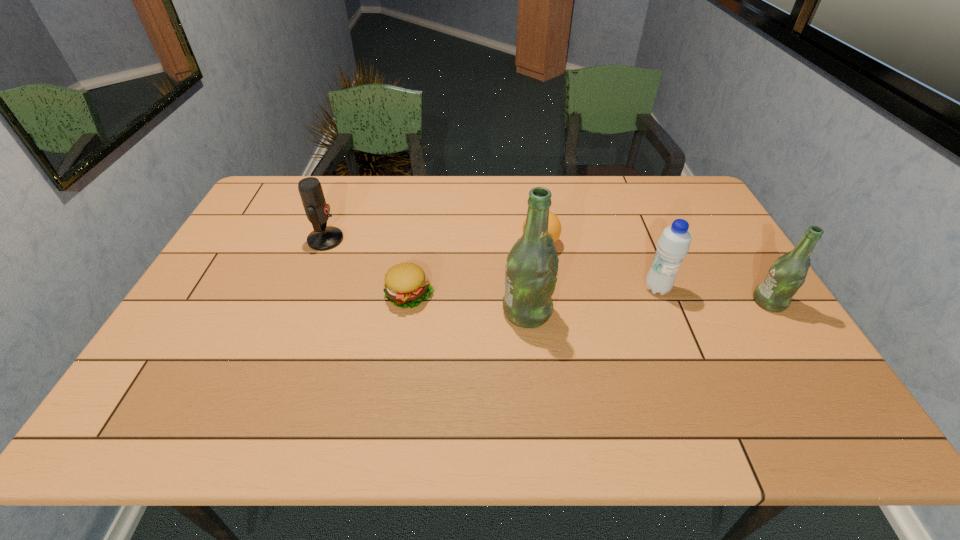
Find the location of a particular element. The width and height of the screenshot is (960, 540). vacant point at the right edge is located at coordinates (695, 279).

Identify the location of free space at the far left corner of the desktop. (280, 213).

In the image, there is a desktop. Where is `vacant space at the far right corner`? This screenshot has width=960, height=540. vacant space at the far right corner is located at coordinates (673, 181).

The width and height of the screenshot is (960, 540). I want to click on vacant region at the near right corner of the desktop, so click(x=789, y=366).

Image resolution: width=960 pixels, height=540 pixels. In order to click on empty space between the shorter beer bottle and the second object from left to right in this screenshot , I will do `click(589, 298)`.

In order to click on vacant area that lies between the water bottle and the microphone in this screenshot , I will do `click(492, 264)`.

Find the location of a particular element. This screenshot has width=960, height=540. free space between the leftmost object and the tallest object is located at coordinates (426, 275).

Where is `free space between the second object from right to left and the left beer bottle`? free space between the second object from right to left and the left beer bottle is located at coordinates (592, 300).

What are the coordinates of `free spot between the second object from right to left and the leftmost object` in the screenshot? It's located at (492, 264).

The image size is (960, 540). What are the coordinates of `vacant space that's between the second object from right to left and the leftmost object` in the screenshot? It's located at (492, 264).